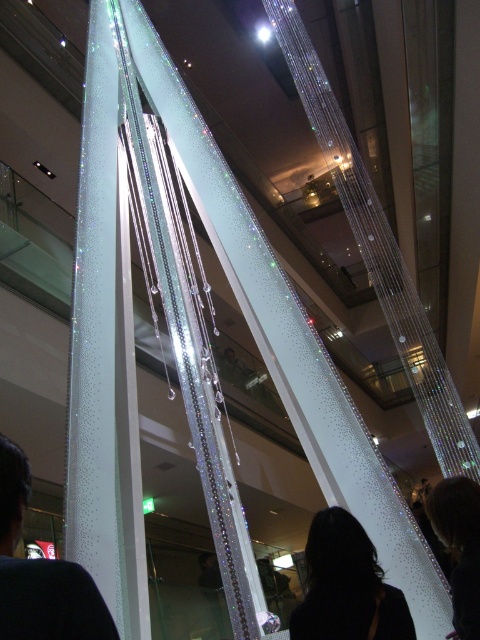
You are a photographer trying to capture the black fabric at lower left and the black hair at center in the same frame. Which object should you focus on first if you want to ensure both are in focus without adjusting your camera settings?

The black fabric at lower left has a smaller size compared to black hair at center, so focusing on the larger black hair at center first would give a greater depth of field, making both objects in focus.

You are standing in the shopping mall and want to determine the relative positions of two points in the image. Which point is nearer to you, point [9,480] or point [324,588]?

Point [9,480] is closer to the viewer than point [324,588].